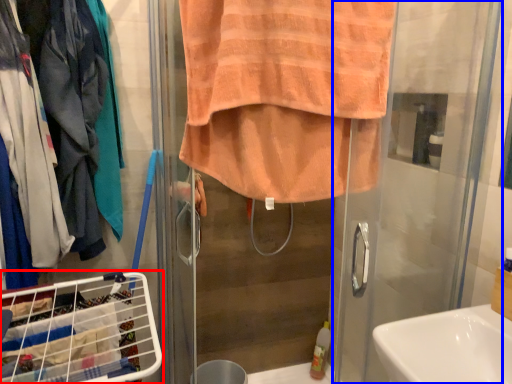
Question: Which object is further to the camera taking this photo, laundry basket (highlighted by a red box) or screen door (highlighted by a blue box)?

Choices:
 (A) laundry basket
 (B) screen door

Answer: (A)